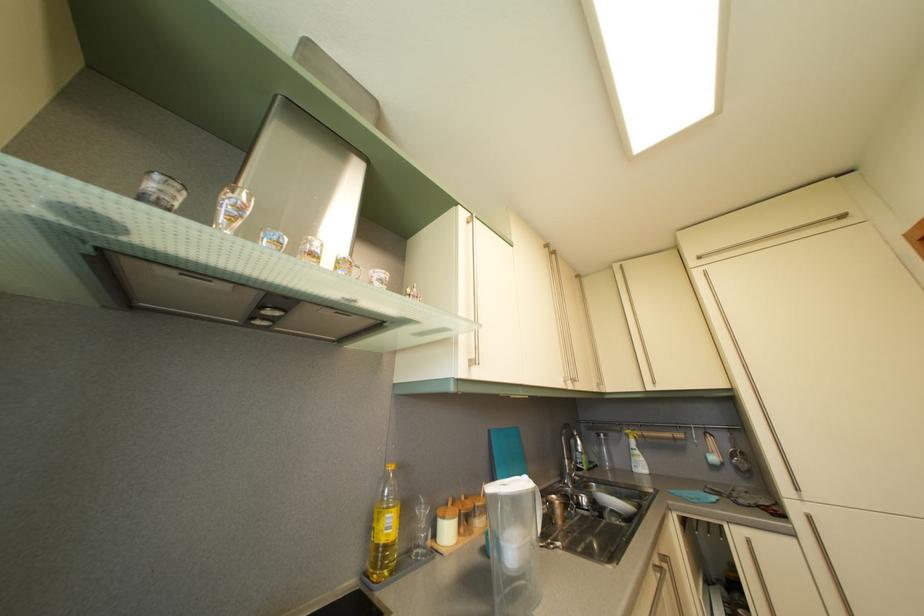
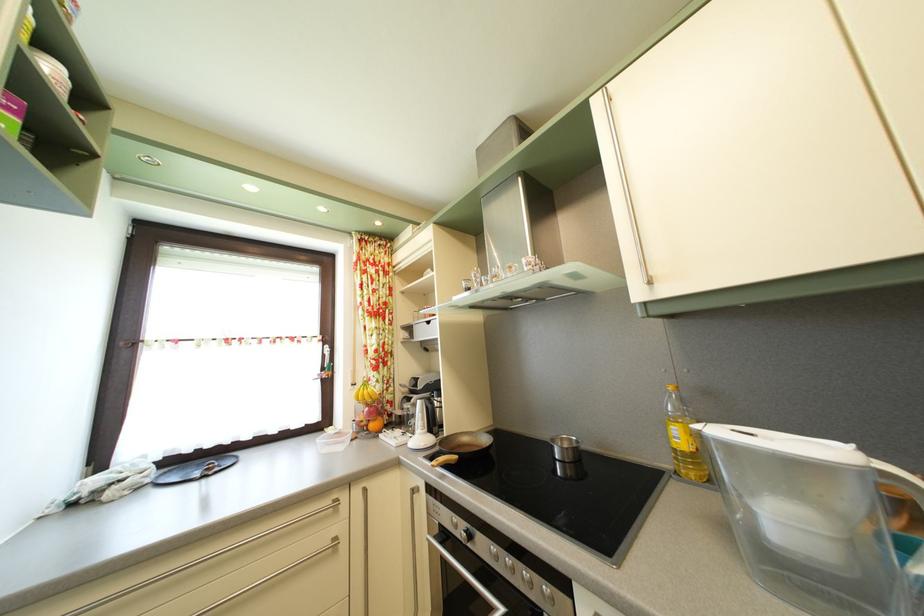
Locate, in the second image, the point that corresponds to point (399, 475) in the first image.

(678, 395)